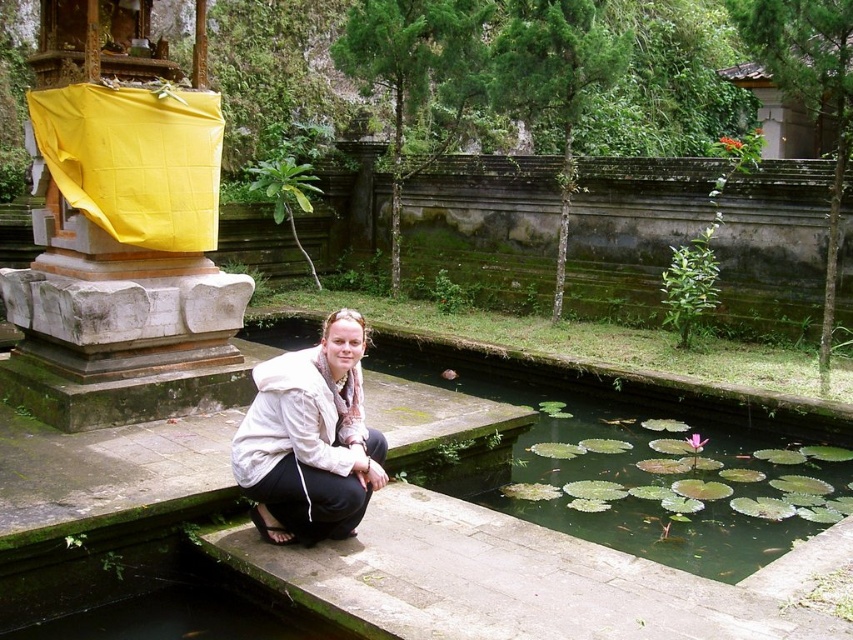
You are a photographer standing at the edge of the pond. You want to capture a photo that includes both the green lily pads at center and the white fabric at center. What is the minimum distance you need to move backward to ensure both objects are in frame?

The minimum distance you need to move backward is 8.44 meters to ensure both the green lily pads at center and the white fabric at center are in frame.

You are a photographer trying to capture a closeup of the green lily pads at center and the white fabric at center. Which object is wider?

The white fabric at center is wider than the green lily pads at center.